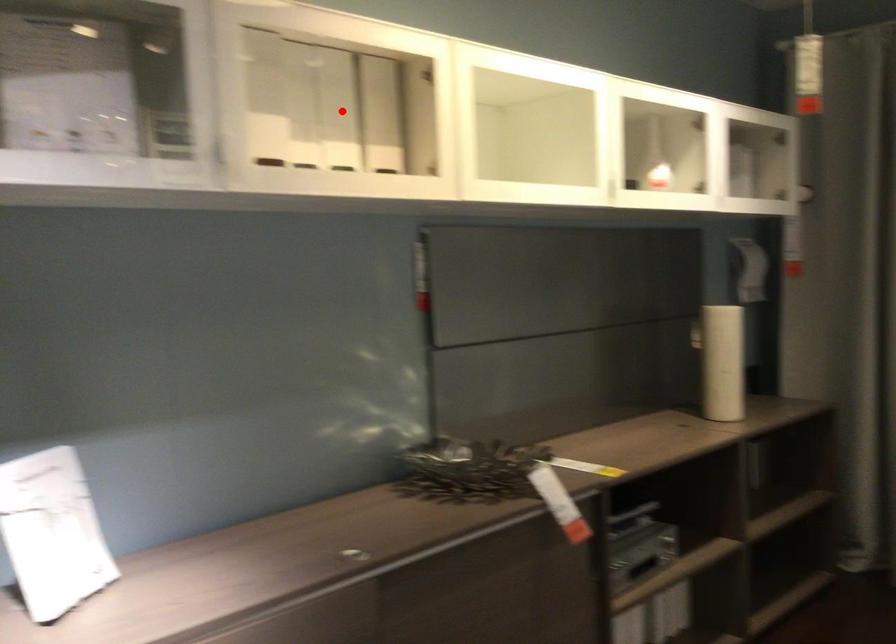
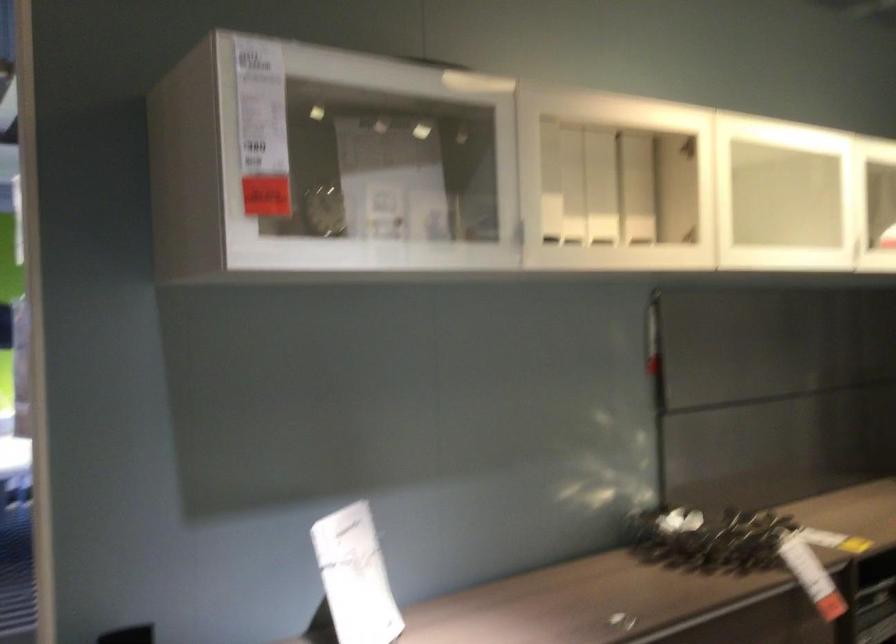
The point at the highlighted location is marked in the first image. Where is the corresponding point in the second image?

(600, 187)